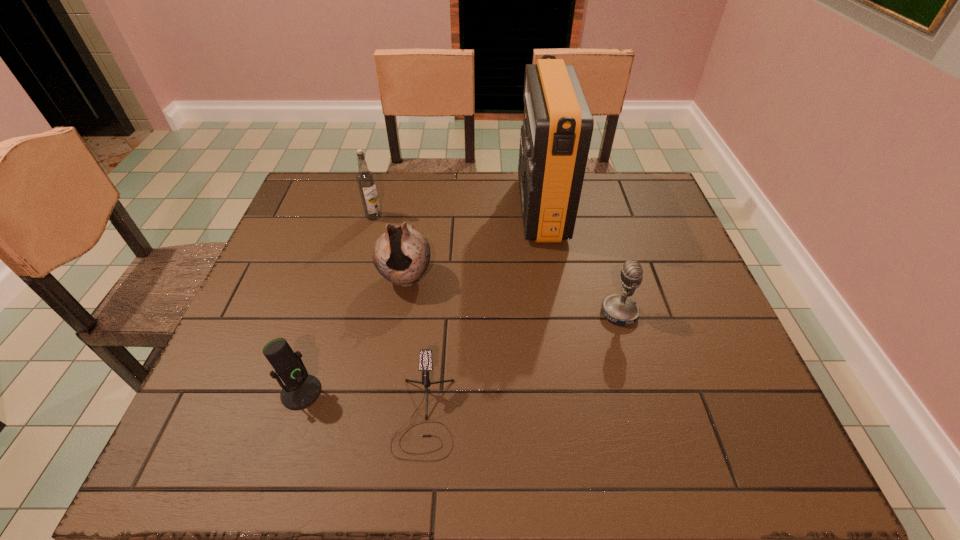
Find the location of `free space located 0.050m on the front-facing side of the radio receiver`. free space located 0.050m on the front-facing side of the radio receiver is located at coordinates (502, 208).

You are a GUI agent. You are given a task and a screenshot of the screen. Output one action in this format:
    pyautogui.click(x=<x>, y=<y>)
    Task: Click on the vacant space located 0.060m on the front-facing side of the radio receiver
    
    Given the screenshot: What is the action you would take?
    pyautogui.click(x=499, y=208)

Where is `free location located on the label of the vodka`? free location located on the label of the vodka is located at coordinates (356, 280).

Locate an element on the screen. This screenshot has height=540, width=960. vacant space located from the spout of the fourth nearest object is located at coordinates (397, 328).

In order to click on vacant space located on the front-facing side of the rightmost microphone in this screenshot , I will do `click(434, 313)`.

Locate an element on the screen. The height and width of the screenshot is (540, 960). free space located on the front-facing side of the rightmost microphone is located at coordinates (580, 313).

This screenshot has height=540, width=960. I want to click on free location located on the front-facing side of the rightmost microphone, so click(484, 313).

Where is `vacant space located on the back of the leftmost microphone`? The image size is (960, 540). vacant space located on the back of the leftmost microphone is located at coordinates (324, 320).

Locate an element on the screen. The width and height of the screenshot is (960, 540). radio receiver that is at the far edge is located at coordinates (555, 138).

In order to click on vodka that is at the far edge in this screenshot , I will do `click(365, 178)`.